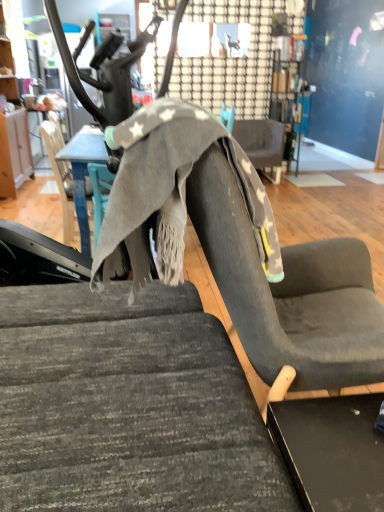
Question: Is textured gray fabric chair at center, arranged as the third chair when viewed from the back, inside or outside of textured gray fabric swivel chair at center?

Choices:
 (A) inside
 (B) outside

Answer: (B)

Question: Relative to textured gray fabric swivel chair at center, is textured gray fabric chair at center, the second chair viewed from the left, in front or behind?

Choices:
 (A) front
 (B) behind

Answer: (A)

Question: Estimate the real-world distances between objects in this image. Which object is farther from the textured gray fabric chair at center, the first chair positioned from the front?

Choices:
 (A) wooden cabinet at left
 (B) textured gray fabric swivel chair at center
 (C) gray fabric chair at center, the second chair when ordered from top to bottom
 (D) gray fabric table at center
 (E) gray fabric chair at center, the 1th chair in the back-to-front sequence

Answer: (E)

Question: Which object is the closest to the textured gray fabric chair at center, the second chair viewed from the left?

Choices:
 (A) textured gray fabric swivel chair at center
 (B) gray fabric table at center
 (C) gray fabric chair at center, which is the second chair from back to front
 (D) gray fabric chair at center, positioned as the third chair in bottom-to-top order
 (E) wooden cabinet at left

Answer: (A)